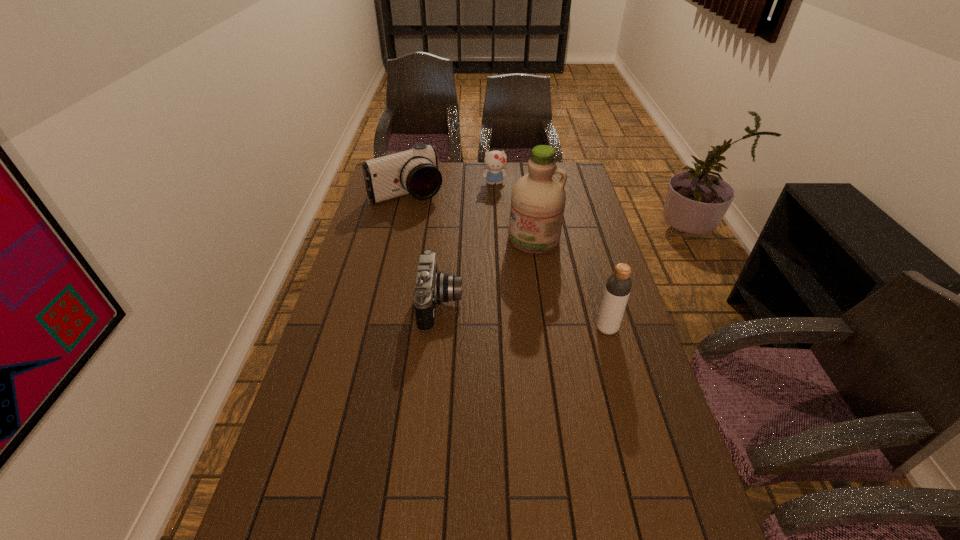
At what (x,y) coordinates should I click in order to perform the action: click on vacant area located on the front-facing side of the kitten. Please return your answer as a coordinate pair (x, y). Image resolution: width=960 pixels, height=540 pixels. Looking at the image, I should click on (497, 202).

The height and width of the screenshot is (540, 960). I want to click on free space located on the front-facing side of the kitten, so click(497, 204).

Identify the location of free space located 0.140m on the front label of the cleansing agent. pos(516,280).

I want to click on free space located on the front label of the cleansing agent, so click(512, 292).

Where is `vacant space situated on the front label of the cleansing agent`? The image size is (960, 540). vacant space situated on the front label of the cleansing agent is located at coordinates (507, 302).

Identify the location of vacant space located on the surface of the camcorder. This screenshot has width=960, height=540. (460, 246).

Identify the location of vacant point located on the surface of the camcorder. This screenshot has width=960, height=540. (443, 227).

At what (x,y) coordinates should I click in order to perform the action: click on blank space located on the surface of the camcorder. Please return your answer as a coordinate pair (x, y). This screenshot has height=540, width=960. Looking at the image, I should click on (437, 221).

You are a GUI agent. You are given a task and a screenshot of the screen. Output one action in this format:
    pyautogui.click(x=<x>, y=<y>)
    Task: Click on the kitten located at the far edge
    
    Given the screenshot: What is the action you would take?
    pyautogui.click(x=495, y=161)

Find the location of a particular element. Image resolution: width=960 pixels, height=540 pixels. camcorder that is at the far edge is located at coordinates (415, 171).